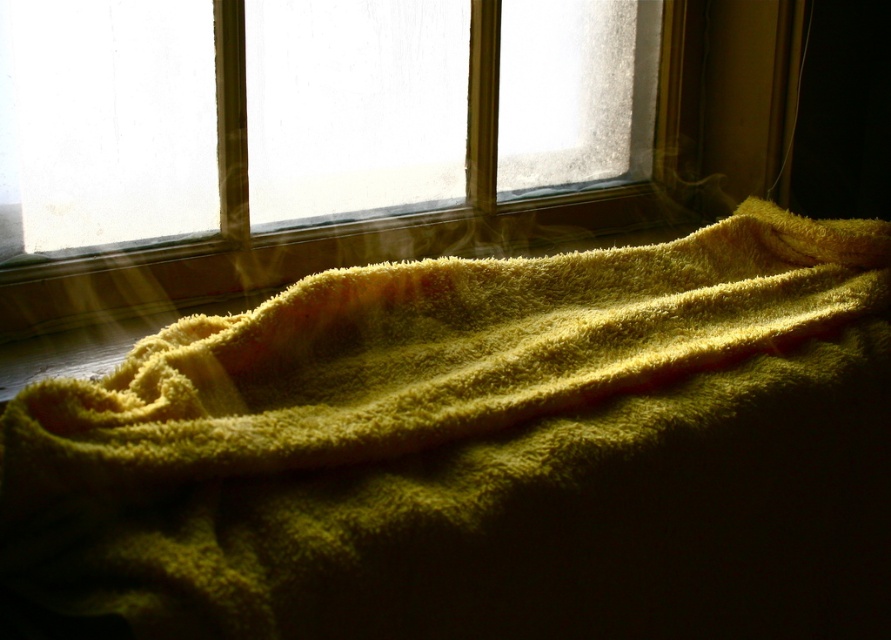
Which is below, yellow fuzzy towel at center or translucent glass window at upper center?

yellow fuzzy towel at center is below.

How far apart are yellow fuzzy towel at center and translucent glass window at upper center?

A distance of 44.32 centimeters exists between yellow fuzzy towel at center and translucent glass window at upper center.

This screenshot has height=640, width=891. Identify the location of yellow fuzzy towel at center. (476, 445).

Where is `yellow fuzzy towel at center`? yellow fuzzy towel at center is located at coordinates (476, 445).